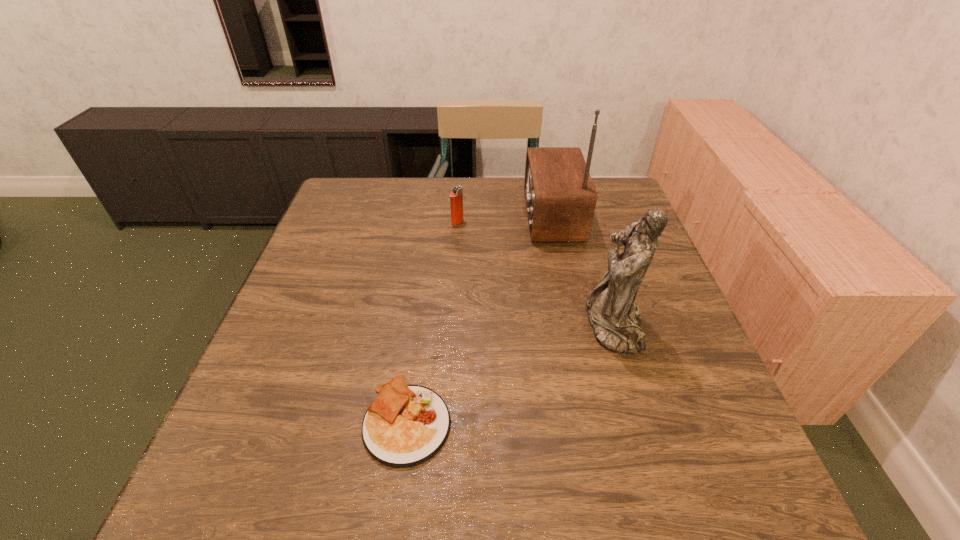
At what (x,y) coordinates should I click in order to perform the action: click on vacant space at the left edge. Please return your answer as a coordinate pair (x, y). This screenshot has width=960, height=540. Looking at the image, I should click on (324, 311).

You are a GUI agent. You are given a task and a screenshot of the screen. Output one action in this format:
    pyautogui.click(x=<x>, y=<y>)
    Task: Click on the vacant point at the right edge
    
    Given the screenshot: What is the action you would take?
    pyautogui.click(x=603, y=248)

The height and width of the screenshot is (540, 960). I want to click on free space at the far left corner of the desktop, so click(x=353, y=205).

In the image, there is a desktop. Where is `vacant space at the near left corner`? This screenshot has height=540, width=960. vacant space at the near left corner is located at coordinates (188, 497).

In the image, there is a desktop. Identify the location of free space at the far right corner. (612, 182).

In order to click on vacant area at the near right corner of the desktop in this screenshot , I will do `click(776, 519)`.

Where is `vacant space in between the radio receiver and the shortest object`? This screenshot has width=960, height=540. vacant space in between the radio receiver and the shortest object is located at coordinates (479, 318).

At what (x,y) coordinates should I click in order to perform the action: click on free space between the igniter and the radio receiver. Please return your answer as a coordinate pair (x, y). Looking at the image, I should click on (504, 219).

The width and height of the screenshot is (960, 540). In order to click on free space between the third tallest object and the radio receiver in this screenshot , I will do `click(504, 219)`.

This screenshot has width=960, height=540. What are the coordinates of `free spot between the nearest object and the radio receiver` in the screenshot? It's located at tap(479, 318).